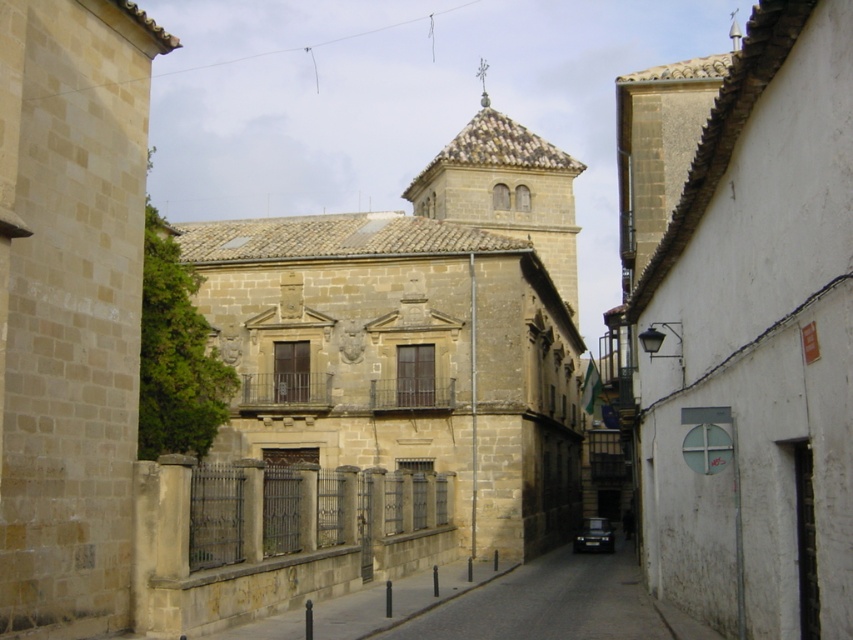
You are a delivery person trying to park your motorcycle on the narrow street. The motorcycle requires a space of at least 1.5 meters in width. Can you park your motorcycle at the location marked by point (x=556, y=604)?

The point (x=556, y=604) marks dark gray asphalt at center. Since asphalt is a suitable surface for parking, and there is no information provided about the width of the space at that location, it is not possible to determine if the motorcycle can be parked there based on the given information.

You are standing on the narrow street looking at the white stucco church at center and the brown stone tower at center. Which structure is located higher up in the image?

The white stucco church at center is positioned under the brown stone tower at center, so the brown stone tower at center is higher up in the image.